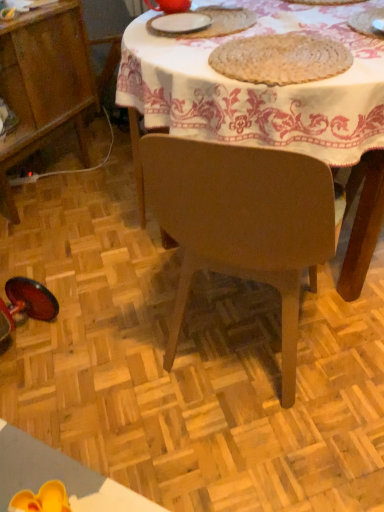
This screenshot has height=512, width=384. Find the location of `vacant region to the left of white woven placemat at upper right, which ranks as the 1th tableware in right-to-left order`. vacant region to the left of white woven placemat at upper right, which ranks as the 1th tableware in right-to-left order is located at coordinates (300, 32).